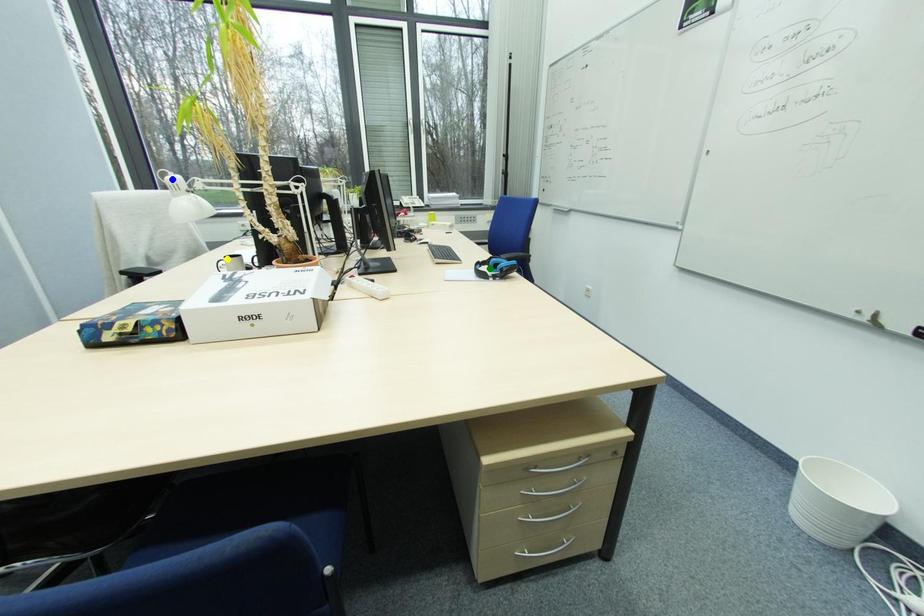
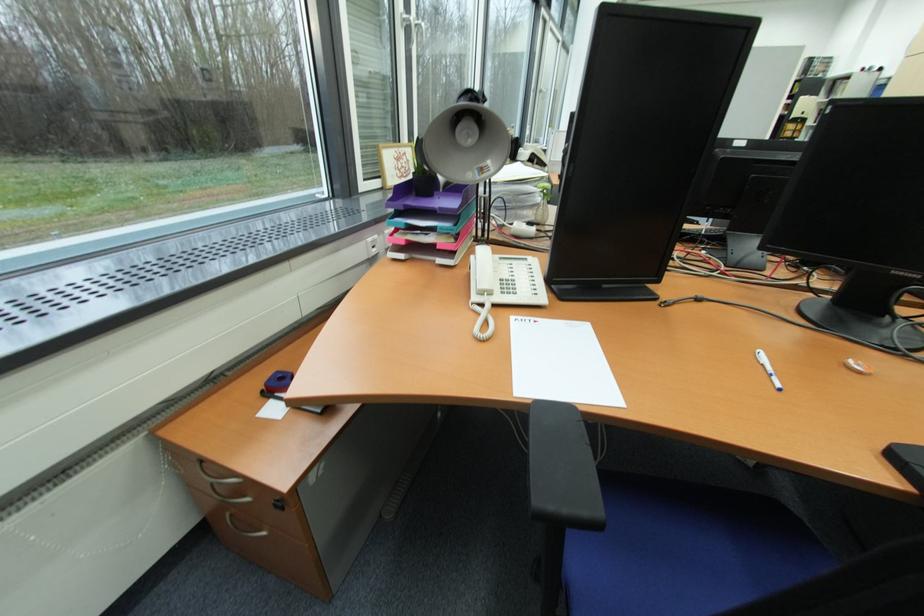
I am providing you with two images of the same scene from different viewpoints. Three points are marked in image1. Which point corresponds to a part or object that is occluded in image2?In image1, three points are marked. Which of them correspond to a part or object that is occluded in image2?Among the three points shown in image1, which one corresponds to a part or object that is no longer visible due to occlusion in image2?

yellow point, green point, blue point cannot be seen in image2.